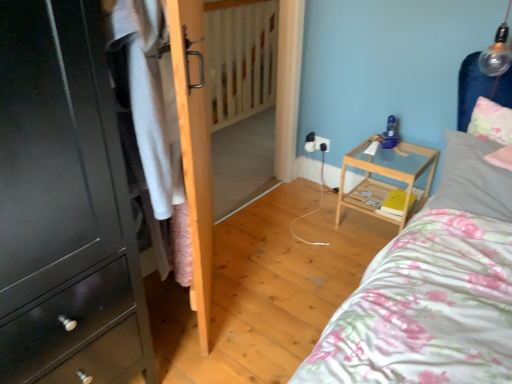
Where is `wooden door at left`? wooden door at left is located at coordinates (194, 148).

Describe the element at coordinates (194, 148) in the screenshot. I see `wooden door at left` at that location.

What do you see at coordinates (385, 176) in the screenshot? This screenshot has height=384, width=512. I see `light wood/transparent glass nightstand at center-right` at bounding box center [385, 176].

What do you see at coordinates (322, 143) in the screenshot? I see `white plastic electric outlet at center` at bounding box center [322, 143].

The width and height of the screenshot is (512, 384). Describe the element at coordinates (64, 205) in the screenshot. I see `matte black cabinet at left` at that location.

Where is `gray fabric pillow at upper right, arranged as the second pillow when viewed from the top`? This screenshot has width=512, height=384. gray fabric pillow at upper right, arranged as the second pillow when viewed from the top is located at coordinates (473, 179).

How much space does gray fabric pillow at upper right, placed as the 1th pillow when sorted from bottom to top, occupy vertically?

The height of gray fabric pillow at upper right, placed as the 1th pillow when sorted from bottom to top, is 7.72 inches.

Find the location of a particular element. wooden door at left is located at coordinates (194, 148).

Is gray fabric pillow at upper right, arranged as the second pillow when viewed from the top, inside or outside of fluffy white pillow at upper right, which is the 1th pillow in top-to-bottom order?

gray fabric pillow at upper right, arranged as the second pillow when viewed from the top, is located beyond the bounds of fluffy white pillow at upper right, which is the 1th pillow in top-to-bottom order.

Is gray fabric pillow at upper right, arranged as the second pillow when viewed from the top, looking in the opposite direction of fluffy white pillow at upper right, which is the 1th pillow in top-to-bottom order?

Yes.

Is the position of gray fabric pillow at upper right, arranged as the second pillow when viewed from the top, more distant than that of fluffy white pillow at upper right, acting as the second pillow starting from the bottom?

That is False.

Visually, is gray fabric pillow at upper right, placed as the 1th pillow when sorted from bottom to top, positioned to the left or to the right of fluffy white pillow at upper right, which is the 1th pillow in top-to-bottom order?

Clearly, gray fabric pillow at upper right, placed as the 1th pillow when sorted from bottom to top, is on the left of fluffy white pillow at upper right, which is the 1th pillow in top-to-bottom order, in the image.

What's the angular difference between white plastic electric outlet at center and gray fabric pillow at upper right, placed as the 1th pillow when sorted from bottom to top,'s facing directions?

There is a 10.4-degree angle between the facing directions of white plastic electric outlet at center and gray fabric pillow at upper right, placed as the 1th pillow when sorted from bottom to top.

Considering the relative sizes of white plastic electric outlet at center and gray fabric pillow at upper right, placed as the 1th pillow when sorted from bottom to top, in the image provided, is white plastic electric outlet at center bigger than gray fabric pillow at upper right, placed as the 1th pillow when sorted from bottom to top,?

Incorrect, white plastic electric outlet at center is not larger than gray fabric pillow at upper right, placed as the 1th pillow when sorted from bottom to top.

Consider the image. Are white plastic electric outlet at center and gray fabric pillow at upper right, placed as the 1th pillow when sorted from bottom to top, making contact?

white plastic electric outlet at center is not next to gray fabric pillow at upper right, placed as the 1th pillow when sorted from bottom to top, and they're not touching.

Which object is positioned more to the right, white plastic electric outlet at center or gray fabric pillow at upper right, placed as the 1th pillow when sorted from bottom to top?

Positioned to the right is gray fabric pillow at upper right, placed as the 1th pillow when sorted from bottom to top.

Can you confirm if wooden radiator at center is positioned to the right of fluffy white pillow at upper right, acting as the second pillow starting from the bottom?

In fact, wooden radiator at center is to the left of fluffy white pillow at upper right, acting as the second pillow starting from the bottom.

Which object is closer to the camera, wooden radiator at center or fluffy white pillow at upper right, acting as the second pillow starting from the bottom?

Positioned in front is fluffy white pillow at upper right, acting as the second pillow starting from the bottom.

From the image's perspective, is wooden radiator at center above or below fluffy white pillow at upper right, acting as the second pillow starting from the bottom?

Clearly, from the image's perspective, wooden radiator at center is above fluffy white pillow at upper right, acting as the second pillow starting from the bottom.

Is wooden radiator at center not close to fluffy white pillow at upper right, which is the 1th pillow in top-to-bottom order?

Yes, wooden radiator at center and fluffy white pillow at upper right, which is the 1th pillow in top-to-bottom order, are quite far apart.

Is the position of white cotton shirt at left less distant than that of light wood/transparent glass nightstand at center-right?

Yes.

From a real-world perspective, between white cotton shirt at left and light wood/transparent glass nightstand at center-right, who is vertically lower?

light wood/transparent glass nightstand at center-right.

Based on the photo, is white cotton shirt at left facing away from light wood/transparent glass nightstand at center-right?

No, white cotton shirt at left is not facing away from light wood/transparent glass nightstand at center-right.

Image resolution: width=512 pixels, height=384 pixels. In order to click on clothing above the light wood/transparent glass nightstand at center-right (from a real-world perspective) in this screenshot , I will do `click(154, 123)`.

Is fluffy white pillow at upper right, acting as the second pillow starting from the bottom, not within light wood/transparent glass nightstand at center-right?

Yes.

Is fluffy white pillow at upper right, acting as the second pillow starting from the bottom, positioned far away from light wood/transparent glass nightstand at center-right?

fluffy white pillow at upper right, acting as the second pillow starting from the bottom, is actually quite close to light wood/transparent glass nightstand at center-right.

Considering the sizes of objects fluffy white pillow at upper right, acting as the second pillow starting from the bottom, and light wood/transparent glass nightstand at center-right in the image provided, who is shorter, fluffy white pillow at upper right, acting as the second pillow starting from the bottom, or light wood/transparent glass nightstand at center-right?

fluffy white pillow at upper right, acting as the second pillow starting from the bottom, is shorter.

Is point (420, 206) closer or farther from the camera than point (186, 286)?

Point (420, 206) is positioned farther from the camera compared to point (186, 286).

From a real-world perspective, which object rests below the other?

light wood/transparent glass nightstand at center-right.

Is light wood/transparent glass nightstand at center-right next to white cotton shirt at left and touching it?

No.

Could you tell me if white plastic electric outlet at center is turned towards matte black cabinet at left?

Yes, white plastic electric outlet at center is oriented towards matte black cabinet at left.

Can you tell me how much white plastic electric outlet at center and matte black cabinet at left differ in facing direction?

white plastic electric outlet at center and matte black cabinet at left are facing 91.7 degrees away from each other.

Based on the photo, looking at their sizes, would you say white plastic electric outlet at center is wider or thinner than matte black cabinet at left?

In the image, white plastic electric outlet at center appears to be more narrow than matte black cabinet at left.

Does point (317, 146) lie in front of point (25, 224)?

That is False.

Identify the location of pillow that is under the fluffy white pillow at upper right, acting as the second pillow starting from the bottom (from a real-world perspective). This screenshot has width=512, height=384. (473, 179).

At what (x,y) coordinates should I click in order to perform the action: click on electric outlet that appears on the left of gray fabric pillow at upper right, placed as the 1th pillow when sorted from bottom to top. Please return your answer as a coordinate pair (x, y). Looking at the image, I should click on (322, 143).

Looking at the image, which one is located further to light wood/transparent glass nightstand at center-right, matte black cabinet at left or wooden radiator at center?

wooden radiator at center is positioned further to the anchor light wood/transparent glass nightstand at center-right.

Considering their positions, is gray fabric pillow at upper right, arranged as the second pillow when viewed from the top, positioned closer to wooden radiator at center than white cotton shirt at left?

gray fabric pillow at upper right, arranged as the second pillow when viewed from the top, is positioned closer to the anchor wooden radiator at center.

When comparing their distances from matte black cabinet at left, does wooden door at left or fluffy white pillow at upper right, acting as the second pillow starting from the bottom, seem closer?

The object closer to matte black cabinet at left is wooden door at left.

In the scene shown: When comparing their distances from fluffy white pillow at upper right, acting as the second pillow starting from the bottom, does white plastic electric outlet at center or white cotton shirt at left seem closer?

Based on the image, white plastic electric outlet at center appears to be nearer to fluffy white pillow at upper right, acting as the second pillow starting from the bottom.

Based on their spatial positions, is white plastic electric outlet at center or wooden radiator at center further from matte black cabinet at left?

wooden radiator at center is further to matte black cabinet at left.

From the picture: Which object lies nearer to the anchor point white cotton shirt at left, light wood/transparent glass nightstand at center-right or wooden door at left?

wooden door at left is closer to white cotton shirt at left.

Estimate the real-world distances between objects in this image. Which object is further from fluffy white pillow at upper right, acting as the second pillow starting from the bottom, light wood/transparent glass nightstand at center-right or white cotton shirt at left?

white cotton shirt at left is positioned further to the anchor fluffy white pillow at upper right, acting as the second pillow starting from the bottom.

Which object lies further to the anchor point gray fabric pillow at upper right, arranged as the second pillow when viewed from the top, fluffy white pillow at upper right, which is the 1th pillow in top-to-bottom order, or matte black cabinet at left?

Based on the image, matte black cabinet at left appears to be further to gray fabric pillow at upper right, arranged as the second pillow when viewed from the top.

Where is `nightstand located between gray fabric pillow at upper right, arranged as the second pillow when viewed from the top, and wooden radiator at center in the depth direction`? nightstand located between gray fabric pillow at upper right, arranged as the second pillow when viewed from the top, and wooden radiator at center in the depth direction is located at coordinates (385, 176).

The width and height of the screenshot is (512, 384). I want to click on pillow positioned between gray fabric pillow at upper right, placed as the 1th pillow when sorted from bottom to top, and light wood/transparent glass nightstand at center-right from near to far, so click(x=490, y=121).

Where is `electric outlet between fluffy white pillow at upper right, which is the 1th pillow in top-to-bottom order, and wooden radiator at center in the front-back direction`? electric outlet between fluffy white pillow at upper right, which is the 1th pillow in top-to-bottom order, and wooden radiator at center in the front-back direction is located at coordinates (322, 143).

Find the location of `pillow between white cotton shirt at left and fluffy white pillow at upper right, acting as the second pillow starting from the bottom, in the horizontal direction`. pillow between white cotton shirt at left and fluffy white pillow at upper right, acting as the second pillow starting from the bottom, in the horizontal direction is located at coordinates (473, 179).